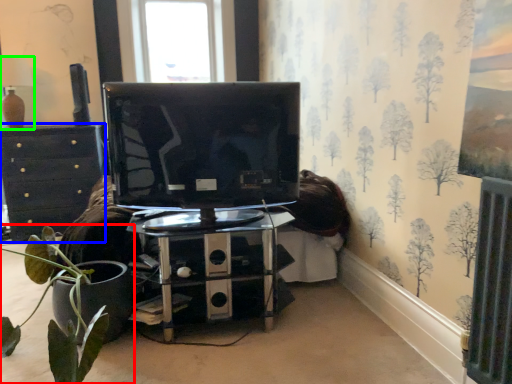
Question: Considering the real-world distances, which object is farthest from houseplant (highlighted by a red box)? chest of drawers (highlighted by a blue box) or lamp (highlighted by a green box)?

Choices:
 (A) chest of drawers
 (B) lamp

Answer: (B)